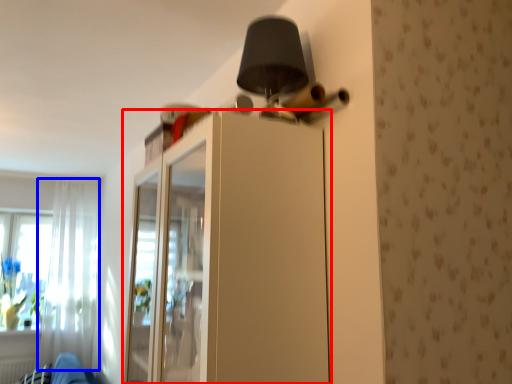
Question: Which point is further to the camera, dresser (highlighted by a red box) or curtain (highlighted by a blue box)?

Choices:
 (A) dresser
 (B) curtain

Answer: (B)